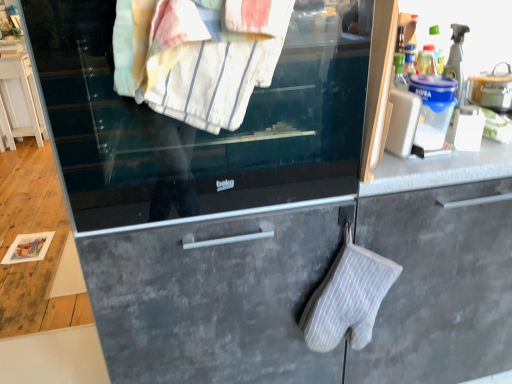
You are a GUI agent. You are given a task and a screenshot of the screen. Output one action in this format:
    pyautogui.click(x=<x>, y=<y>)
    Task: Click on the vacant region in front of white plastic phone at upper right
    The image size is (512, 384).
    Given the screenshot: What is the action you would take?
    pyautogui.click(x=406, y=167)